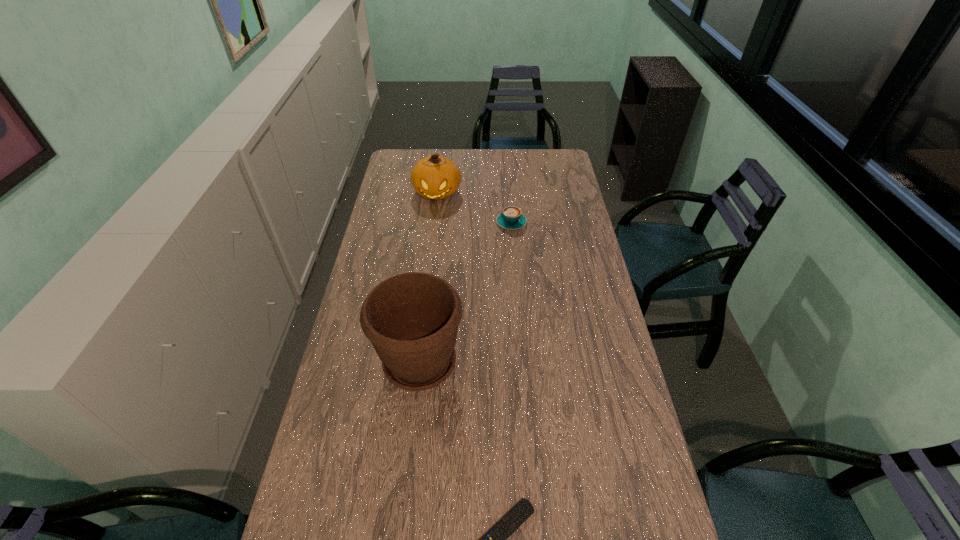
Where is `the tallest object`? This screenshot has width=960, height=540. the tallest object is located at coordinates (411, 319).

Where is `flowerpot`? The image size is (960, 540). flowerpot is located at coordinates (411, 319).

This screenshot has width=960, height=540. Identify the location of pumpkin. (435, 177).

Identify the location of the second tallest object. (435, 177).

Find the location of a particular element. This screenshot has height=540, width=960. the second farthest object is located at coordinates (511, 218).

Identify the location of the third tallest object. (511, 218).

The height and width of the screenshot is (540, 960). What are the coordinates of `vacant space located on the front of the second nearest object` in the screenshot? It's located at (406, 485).

The width and height of the screenshot is (960, 540). What are the coordinates of `free space located 0.090m on the front face of the pumpkin` in the screenshot? It's located at (434, 219).

Locate an element on the screen. vacant space located with the handle on the right side of the third nearest object is located at coordinates [507, 169].

Image resolution: width=960 pixels, height=540 pixels. I want to click on vacant area situated with the handle on the right side of the third nearest object, so click(x=507, y=169).